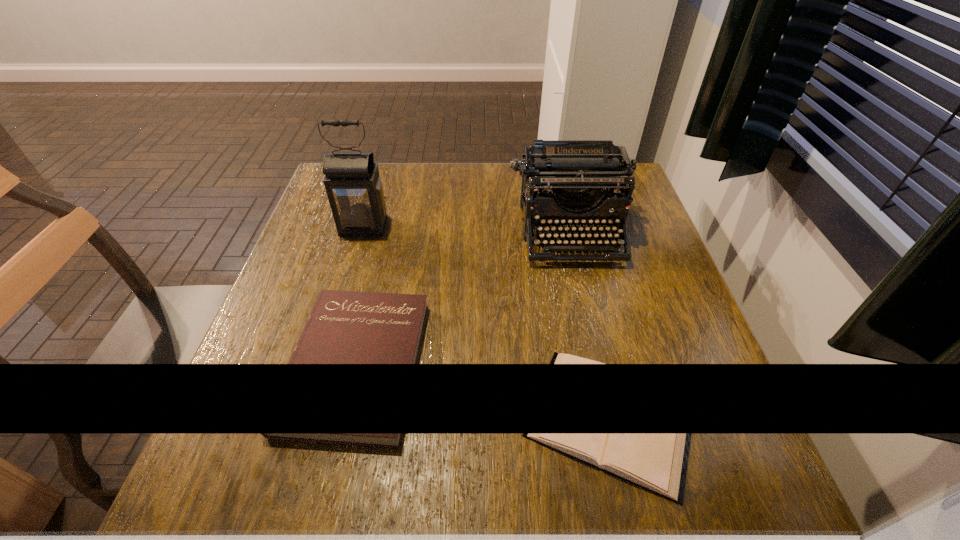
Locate an element on the screen. The image size is (960, 540). the tallest object is located at coordinates (352, 181).

Where is `typewriter`? The image size is (960, 540). typewriter is located at coordinates (569, 175).

Identify the location of the third tallest object. The height and width of the screenshot is (540, 960). click(x=344, y=327).

You are a GUI agent. You are given a task and a screenshot of the screen. Output one action in this format:
    pyautogui.click(x=<x>, y=<y>)
    Task: Click on the left hardback book
    The image size is (960, 540).
    Given the screenshot: What is the action you would take?
    pyautogui.click(x=344, y=327)

Identify the location of the right hardback book. This screenshot has width=960, height=540. (558, 358).

Image resolution: width=960 pixels, height=540 pixels. What are the coordinates of `the shortest object` in the screenshot? It's located at (558, 358).

This screenshot has width=960, height=540. What are the coordinates of `vacant space located on the front-facing side of the lantern` in the screenshot? It's located at (332, 330).

Find the location of a particular element. free space located 0.050m on the typing side of the typewriter is located at coordinates (582, 284).

The image size is (960, 540). What are the coordinates of `vacant space situated 0.080m on the right of the taller hardback book` in the screenshot? It's located at (466, 363).

Find the location of a particular element. The height and width of the screenshot is (540, 960). vacant space positioned 0.160m on the back of the shorter hardback book is located at coordinates (582, 291).